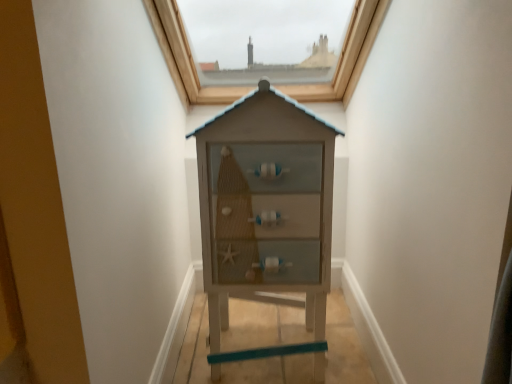
Question: Should I look upward or downward to see wooden cabinet at center?

Choices:
 (A) up
 (B) down

Answer: (B)

Question: From a real-world perspective, is matte brown wooden window at upper center physically above wooden cabinet at center?

Choices:
 (A) no
 (B) yes

Answer: (B)

Question: Considering the relative sizes of matte brown wooden window at upper center and wooden cabinet at center in the image provided, is matte brown wooden window at upper center taller than wooden cabinet at center?

Choices:
 (A) no
 (B) yes

Answer: (A)

Question: Are matte brown wooden window at upper center and wooden cabinet at center located far from each other?

Choices:
 (A) yes
 (B) no

Answer: (B)

Question: Is matte brown wooden window at upper center oriented away from wooden cabinet at center?

Choices:
 (A) no
 (B) yes

Answer: (A)

Question: From a real-world perspective, is matte brown wooden window at upper center beneath wooden cabinet at center?

Choices:
 (A) no
 (B) yes

Answer: (A)

Question: Does matte brown wooden window at upper center lie in front of wooden cabinet at center?

Choices:
 (A) yes
 (B) no

Answer: (B)

Question: Is the position of wooden cabinet at center more distant than that of matte brown wooden window at upper center?

Choices:
 (A) yes
 (B) no

Answer: (B)

Question: Is wooden cabinet at center far away from matte brown wooden window at upper center?

Choices:
 (A) yes
 (B) no

Answer: (B)

Question: From the image's perspective, is wooden cabinet at center located beneath matte brown wooden window at upper center?

Choices:
 (A) yes
 (B) no

Answer: (A)

Question: Is wooden cabinet at center to the right of matte brown wooden window at upper center from the viewer's perspective?

Choices:
 (A) no
 (B) yes

Answer: (B)

Question: Is wooden cabinet at center bigger than matte brown wooden window at upper center?

Choices:
 (A) no
 (B) yes

Answer: (A)

Question: Does wooden cabinet at center have a lesser width compared to matte brown wooden window at upper center?

Choices:
 (A) yes
 (B) no

Answer: (A)

Question: Choose the correct answer: Is wooden cabinet at center inside matte brown wooden window at upper center or outside it?

Choices:
 (A) outside
 (B) inside

Answer: (A)